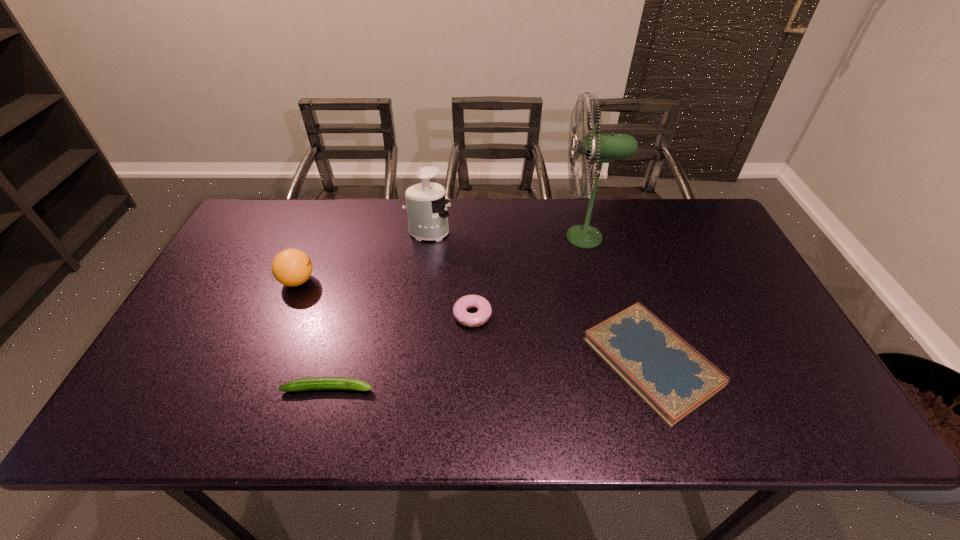
The width and height of the screenshot is (960, 540). Find the location of `the tallest object`. the tallest object is located at coordinates (600, 148).

Locate an element on the screen. This screenshot has height=540, width=960. juicer is located at coordinates (427, 213).

Locate an element on the screen. The width and height of the screenshot is (960, 540). the third object from left to right is located at coordinates (427, 213).

At what (x,y) coordinates should I click in order to perform the action: click on the leftmost object. Please return your answer as a coordinate pair (x, y). The height and width of the screenshot is (540, 960). Looking at the image, I should click on (291, 267).

Locate an element on the screen. the fourth nearest object is located at coordinates (291, 267).

Identify the location of the fourth object from left to right. (460, 308).

The image size is (960, 540). In order to click on paperback book in this screenshot , I will do `click(673, 378)`.

At what (x,y) coordinates should I click in order to perform the action: click on zucchini. Please return your answer as a coordinate pair (x, y). Image resolution: width=960 pixels, height=540 pixels. Looking at the image, I should click on (316, 383).

Locate an element on the screen. vacant space situated on the front-facing side of the tallest object is located at coordinates [x=470, y=237].

This screenshot has height=540, width=960. I want to click on vacant space located on the front-facing side of the tallest object, so click(x=448, y=237).